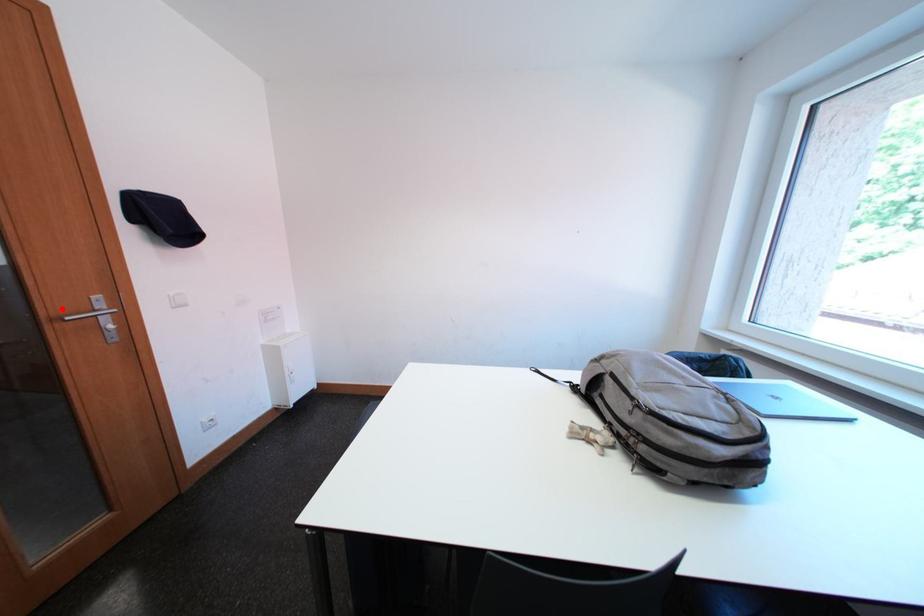
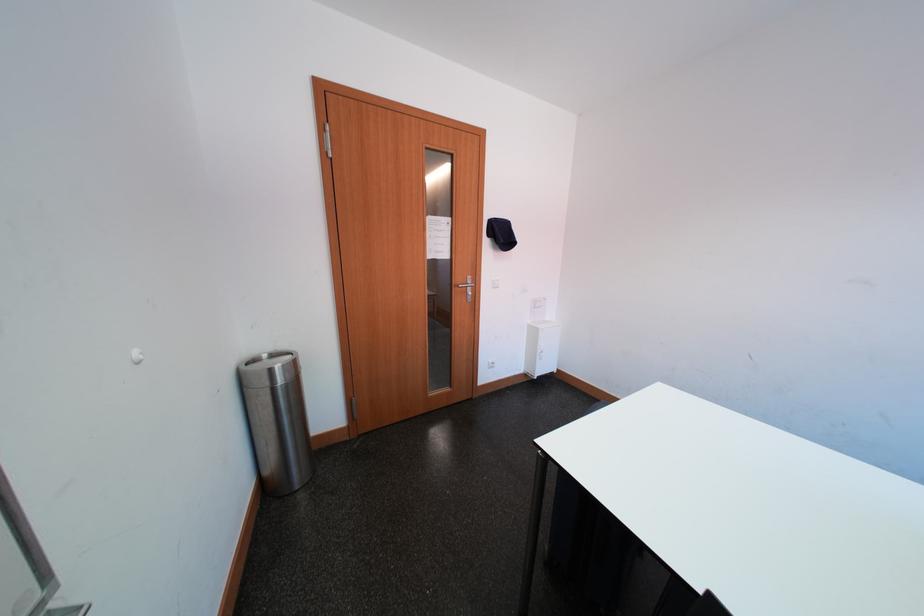
Question: I am providing you with two images of the same scene from different viewpoints. A red point is shown in image1. For the corresponding object point in image2, is it positioned nearer or farther from the camera?

Choices:
 (A) Nearer
 (B) Farther

Answer: (B)